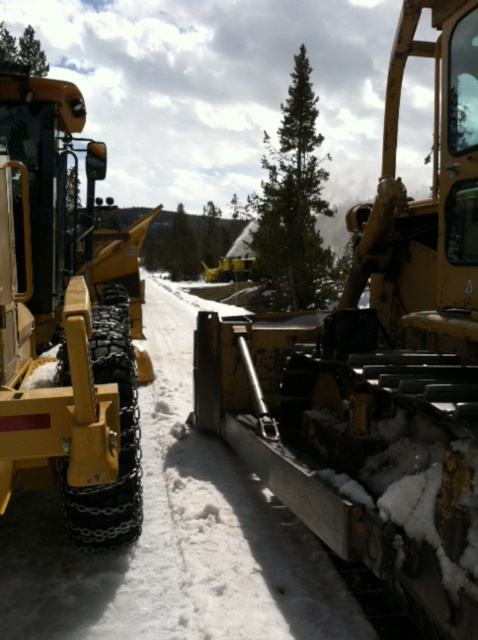
In the scene shown: Does matte yellow tractor at center appear on the left side of green textured pine at center?

Indeed, matte yellow tractor at center is positioned on the left side of green textured pine at center.

What do you see at coordinates (380, 364) in the screenshot? The height and width of the screenshot is (640, 478). I see `matte yellow tractor at center` at bounding box center [380, 364].

Is point (446, 232) closer to camera compared to point (306, 182)?

Yes.

Locate an element on the screen. matte yellow tractor at center is located at coordinates (380, 364).

Between matte yellow tractor at center and yellow rubber tractor at left, which one has less height?

yellow rubber tractor at left is shorter.

Measure the distance between matte yellow tractor at center and camera.

matte yellow tractor at center is 6.73 feet away from camera.

Locate an element on the screen. matte yellow tractor at center is located at coordinates (380, 364).

Can you confirm if yellow rubber tractor at left is positioned above green textured pine at center?

Actually, yellow rubber tractor at left is below green textured pine at center.

Locate an element on the screen. This screenshot has height=640, width=478. yellow rubber tractor at left is located at coordinates (65, 317).